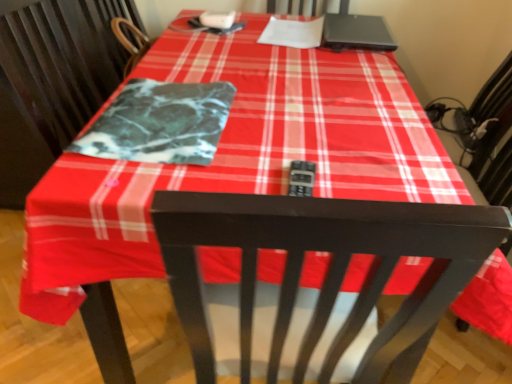
The width and height of the screenshot is (512, 384). Describe the element at coordinates (356, 32) in the screenshot. I see `black matte laptop at upper right` at that location.

I want to click on black matte laptop at upper right, so click(x=356, y=32).

Measure the distance between point (362, 27) and camera.

Point (362, 27) is 5.07 feet away from camera.

In order to face black matte laptop at upper right, should I rotate leftwards or rightwards?

You should look right and rotate roughly 13.380 degrees.

Where is `marble-like fabric at center`? marble-like fabric at center is located at coordinates (160, 123).

Describe the element at coordinates (160, 123) in the screenshot. Image resolution: width=512 pixels, height=384 pixels. I see `marble-like fabric at center` at that location.

You are a GUI agent. You are given a task and a screenshot of the screen. Output one action in this format:
    pyautogui.click(x=<x>, y=<y>)
    Task: Click on the black matte laptop at upper right
    
    Given the screenshot: What is the action you would take?
    pyautogui.click(x=356, y=32)

Visually, is marble-like fabric at center positioned to the left or to the right of black matte laptop at upper right?

Based on their positions, marble-like fabric at center is located to the left of black matte laptop at upper right.

Considering their positions, is marble-like fabric at center located in front of or behind black matte laptop at upper right?

Clearly, marble-like fabric at center is in front of black matte laptop at upper right.

Is point (201, 98) positioned in front of point (378, 46)?

Yes, point (201, 98) is in front of point (378, 46).

In the scene shown: From the image's perspective, would you say marble-like fabric at center is shown under black matte laptop at upper right?

Indeed, from the image's perspective, marble-like fabric at center is shown beneath black matte laptop at upper right.

Looking at this image, from a real-world perspective, does marble-like fabric at center stand above black matte laptop at upper right?

Incorrect, from a real-world perspective, marble-like fabric at center is lower than black matte laptop at upper right.

Considering the relative sizes of marble-like fabric at center and black matte laptop at upper right in the image provided, is marble-like fabric at center wider than black matte laptop at upper right?

No.

Considering the sizes of marble-like fabric at center and black matte laptop at upper right in the image, is marble-like fabric at center taller or shorter than black matte laptop at upper right?

marble-like fabric at center is shorter than black matte laptop at upper right.

Consider the image. Considering the sizes of marble-like fabric at center and black matte laptop at upper right in the image, is marble-like fabric at center bigger or smaller than black matte laptop at upper right?

Considering their sizes, marble-like fabric at center takes up less space than black matte laptop at upper right.

Is marble-like fabric at center located outside black matte laptop at upper right?

Indeed, marble-like fabric at center is completely outside black matte laptop at upper right.

Is marble-like fabric at center not close to black matte laptop at upper right?

They are positioned close to each other.

Does marble-like fabric at center turn towards black matte laptop at upper right?

No, marble-like fabric at center is not turned towards black matte laptop at upper right.

Measure the distance from marble-like fabric at center to black matte laptop at upper right.

71.06 centimeters.

Where is `blanket in front of the black matte laptop at upper right`? The height and width of the screenshot is (384, 512). blanket in front of the black matte laptop at upper right is located at coordinates (160, 123).

Between black matte laptop at upper right and marble-like fabric at center, which one appears on the left side from the viewer's perspective?

marble-like fabric at center.

Is black matte laptop at upper right closer to the viewer compared to marble-like fabric at center?

No, black matte laptop at upper right is further to the viewer.

Considering the positions of points (331, 22) and (175, 142), is point (331, 22) closer to camera compared to point (175, 142)?

No, it is behind (175, 142).

Looking at this image, from the image's perspective, which one is positioned lower, black matte laptop at upper right or marble-like fabric at center?

marble-like fabric at center appears lower in the image.

From a real-world perspective, is black matte laptop at upper right above or below marble-like fabric at center?

From a real-world perspective, black matte laptop at upper right is physically above marble-like fabric at center.

Does black matte laptop at upper right have a greater width compared to marble-like fabric at center?

Yes, black matte laptop at upper right is wider than marble-like fabric at center.

From their relative heights in the image, would you say black matte laptop at upper right is taller or shorter than marble-like fabric at center?

black matte laptop at upper right is taller than marble-like fabric at center.

Who is smaller, black matte laptop at upper right or marble-like fabric at center?

marble-like fabric at center is smaller.

Is black matte laptop at upper right situated inside marble-like fabric at center or outside?

black matte laptop at upper right exists outside the volume of marble-like fabric at center.

Is black matte laptop at upper right not close to marble-like fabric at center?

No, black matte laptop at upper right is in close proximity to marble-like fabric at center.

Is black matte laptop at upper right positioned with its back to marble-like fabric at center?

No, black matte laptop at upper right's orientation is not away from marble-like fabric at center.

How many degrees apart are the facing directions of black matte laptop at upper right and marble-like fabric at center?

There is a 90-degree angle between the facing directions of black matte laptop at upper right and marble-like fabric at center.

How far apart are black matte laptop at upper right and marble-like fabric at center?

Result: black matte laptop at upper right and marble-like fabric at center are 27.98 inches apart.

You are a GUI agent. You are given a task and a screenshot of the screen. Output one action in this format:
    pyautogui.click(x=<x>, y=<y>)
    Task: Click on the blanket lying below the black matte laptop at upper right (from the image's perspective)
    
    Given the screenshot: What is the action you would take?
    pyautogui.click(x=160, y=123)

In order to click on laptop located behind the marble-like fabric at center in this screenshot , I will do click(x=356, y=32).

Locate an element on the screen. The image size is (512, 384). blanket lying in front of the black matte laptop at upper right is located at coordinates (160, 123).